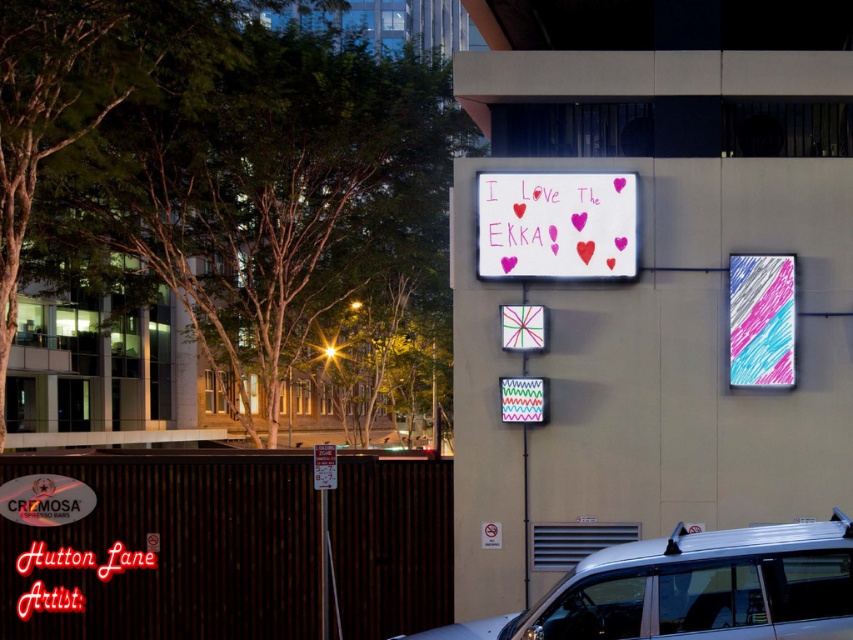
Question: Can you confirm if white paperboard at center is positioned to the left of multicolored fabric sign at center?

Choices:
 (A) no
 (B) yes

Answer: (A)

Question: Among these objects, which one is nearest to the camera?

Choices:
 (A) white glossy sign at upper center
 (B) white paperboard at center
 (C) pastel scribbled sign at upper right

Answer: (A)

Question: Among these points, which one is farthest from the camera?

Choices:
 (A) (776, 372)
 (B) (635, 262)

Answer: (B)

Question: From the image, what is the correct spatial relationship of silver metallic van at lower right in relation to white paperboard at center?

Choices:
 (A) below
 (B) above

Answer: (A)

Question: Among these objects, which one is farthest from the camera?

Choices:
 (A) white paperboard at center
 (B) white glossy sign at upper center
 (C) pastel scribbled sign at upper right
 (D) multicolored fabric sign at center

Answer: (A)

Question: In this image, where is white paperboard at center located relative to white glossy sign at upper center?

Choices:
 (A) left
 (B) right

Answer: (B)